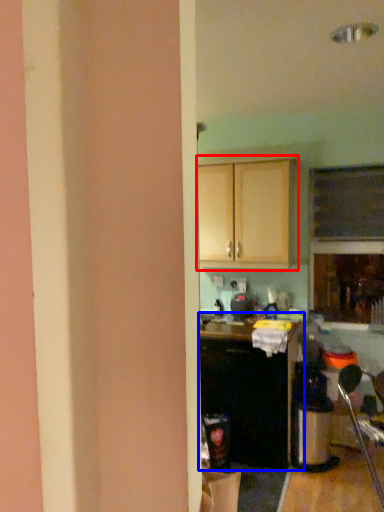
Question: Which object appears closest to the camera in this image, cabinetry (highlighted by a red box) or cabinetry (highlighted by a blue box)?

Choices:
 (A) cabinetry
 (B) cabinetry

Answer: (B)